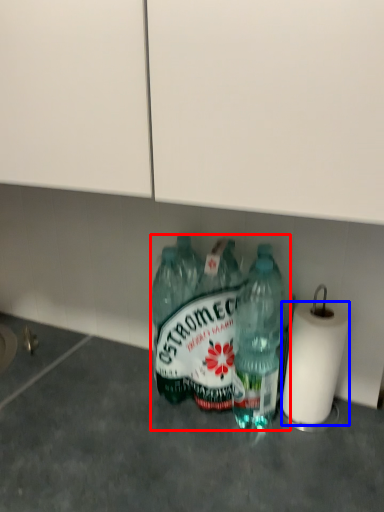
Question: Among these objects, which one is farthest to the camera, bottle (highlighted by a red box) or paper towel (highlighted by a blue box)?

Choices:
 (A) bottle
 (B) paper towel

Answer: (A)